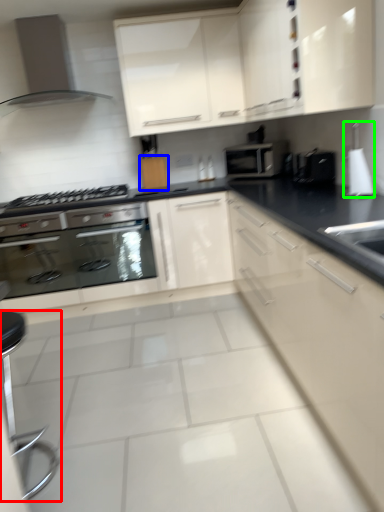
Question: Based on their relative distances, which object is farther from bar stool (highlighted by a red box)? Choose from cabinetry (highlighted by a blue box) and appliance (highlighted by a green box).

Choices:
 (A) cabinetry
 (B) appliance

Answer: (B)